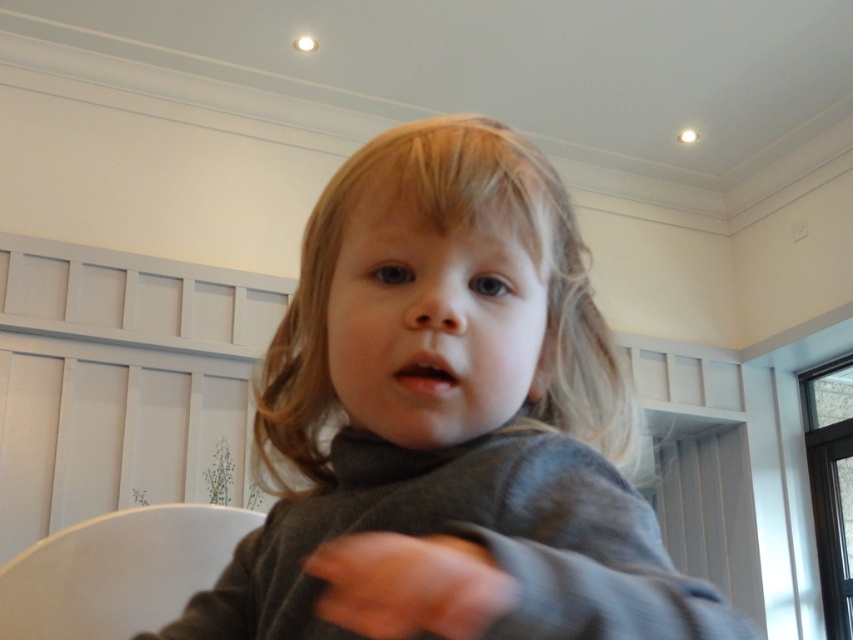
Who is more forward, (x=218, y=540) or (x=469, y=628)?

Point (x=469, y=628)

Can you confirm if white plastic chair at lower left is positioned to the left of smooth gray hand at center?

Correct, you'll find white plastic chair at lower left to the left of smooth gray hand at center.

The width and height of the screenshot is (853, 640). What do you see at coordinates (119, 572) in the screenshot?
I see `white plastic chair at lower left` at bounding box center [119, 572].

The width and height of the screenshot is (853, 640). I want to click on white plastic chair at lower left, so click(x=119, y=572).

Between point (317, 358) and point (207, 509), which one is positioned in front?

Positioned in front is point (317, 358).

Find the location of `blonde silky hair at center`. blonde silky hair at center is located at coordinates (440, 232).

Which is behind, point (610, 371) or point (85, 593)?

The point (85, 593) is behind.

The height and width of the screenshot is (640, 853). I want to click on blonde silky hair at center, so click(440, 232).

Is gray soft sweater at center taller than smooth gray hand at center?

Correct, gray soft sweater at center is much taller as smooth gray hand at center.

Can you confirm if gray soft sweater at center is shorter than smooth gray hand at center?

In fact, gray soft sweater at center may be taller than smooth gray hand at center.

Who is more distant from viewer, (x=496, y=168) or (x=488, y=596)?

Positioned behind is point (x=496, y=168).

I want to click on gray soft sweater at center, so click(448, 420).